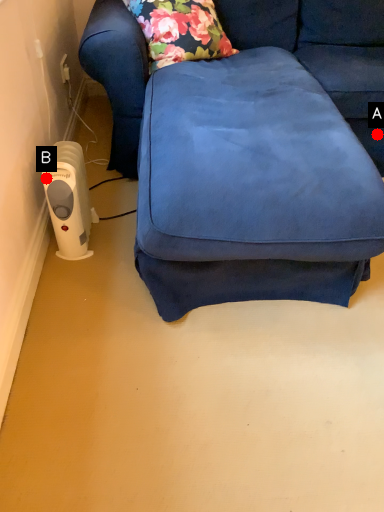
Question: Two points are circled on the image, labeled by A and B beside each circle. Which point is further to the camera?

Choices:
 (A) A is further
 (B) B is further

Answer: (A)